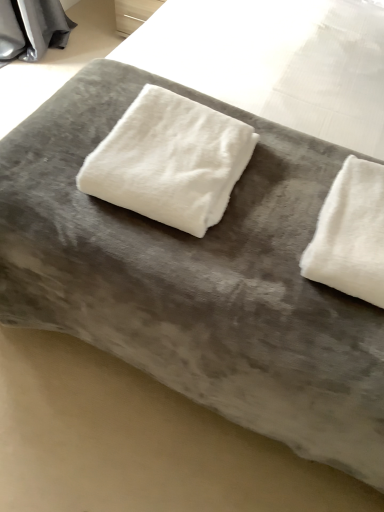
You are a GUI agent. You are given a task and a screenshot of the screen. Output one action in this format:
    pyautogui.click(x=<x>, y=<y>)
    Task: Click on the free space between white fluffy towel at right, the first towel viewed from the right, and white fluffy towel at center, placed as the first towel when sorted from left to right
    
    Given the screenshot: What is the action you would take?
    pyautogui.click(x=273, y=212)